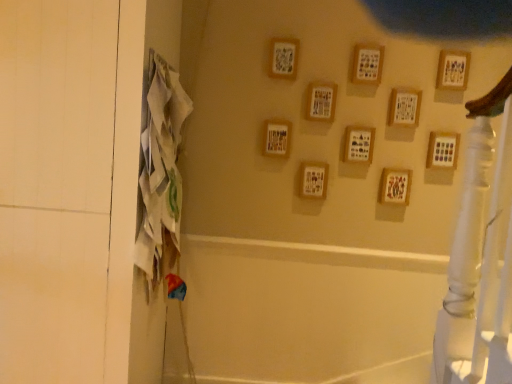
Question: Is white fabric screen door at left facing towards wooden frame at center, which appears as the 8th picture frame when viewed from the right?

Choices:
 (A) yes
 (B) no

Answer: (B)

Question: From a real-world perspective, is white fabric screen door at left positioned over wooden frame at center, the third picture frame when ordered from left to right, based on gravity?

Choices:
 (A) no
 (B) yes

Answer: (A)

Question: From the image's perspective, would you say white fabric screen door at left is positioned over wooden frame at center, the third picture frame when ordered from left to right?

Choices:
 (A) yes
 (B) no

Answer: (B)

Question: Is white fabric screen door at left in front of wooden frame at center, which appears as the 8th picture frame when viewed from the right?

Choices:
 (A) no
 (B) yes

Answer: (B)

Question: Considering the relative sizes of white fabric screen door at left and wooden frame at center, which appears as the 8th picture frame when viewed from the right, in the image provided, is white fabric screen door at left shorter than wooden frame at center, which appears as the 8th picture frame when viewed from the right,?

Choices:
 (A) no
 (B) yes

Answer: (A)

Question: From the image's perspective, relative to wooden picture frame at upper center, marked as the fifth picture frame in a right-to-left arrangement, is wooden frame at center-right, the 7th picture frame from the left, above or below?

Choices:
 (A) above
 (B) below

Answer: (B)

Question: From a real-world perspective, is wooden frame at center-right, the 7th picture frame from the left, physically located above or below wooden picture frame at upper center, which is the 6th picture frame in left-to-right order?

Choices:
 (A) below
 (B) above

Answer: (A)

Question: In the image, is wooden frame at center-right, the 7th picture frame from the left, positioned in front of or behind wooden picture frame at upper center, which is the 6th picture frame in left-to-right order?

Choices:
 (A) behind
 (B) front

Answer: (A)

Question: Based on their positions, is wooden frame at center-right, which ranks as the 4th picture frame in right-to-left order, located to the left or right of wooden picture frame at upper center, marked as the fifth picture frame in a right-to-left arrangement?

Choices:
 (A) left
 (B) right

Answer: (B)

Question: In terms of width, does wooden frame at center, acting as the first picture frame starting from the left, look wider or thinner when compared to wooden frame at upper center, which is the second picture frame in left-to-right order?

Choices:
 (A) thin
 (B) wide

Answer: (B)

Question: From the image's perspective, is wooden frame at center, acting as the first picture frame starting from the left, positioned above or below wooden frame at upper center, which is the second picture frame in left-to-right order?

Choices:
 (A) below
 (B) above

Answer: (A)

Question: Is wooden frame at center, acting as the first picture frame starting from the left, in front of or behind wooden frame at upper center, which is the second picture frame in left-to-right order, in the image?

Choices:
 (A) front
 (B) behind

Answer: (B)

Question: Does point (272, 135) appear closer or farther from the camera than point (290, 79)?

Choices:
 (A) farther
 (B) closer

Answer: (A)

Question: Would you say wooden frame at center-right, which ranks as the 4th picture frame in right-to-left order, is to the left or to the right of wooden picture frame at upper center, arranged as the 3th picture frame when viewed from the right, in the picture?

Choices:
 (A) left
 (B) right

Answer: (A)

Question: Considering the positions of wooden frame at center-right, which ranks as the 4th picture frame in right-to-left order, and wooden picture frame at upper center, arranged as the 3th picture frame when viewed from the right, in the image, is wooden frame at center-right, which ranks as the 4th picture frame in right-to-left order, taller or shorter than wooden picture frame at upper center, arranged as the 3th picture frame when viewed from the right,?

Choices:
 (A) tall
 (B) short

Answer: (B)